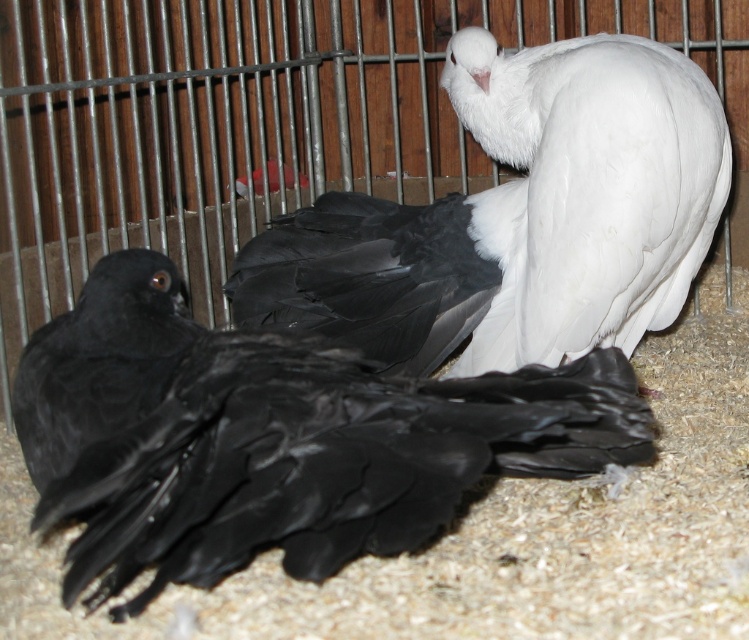
Based on the photo, you are a bird enthusiast observing the two pigeons in the cage. The black glossy feathers at center and the white feathered bird at upper right are both visible. Which of these two objects is positioned to the left of the other?

The black glossy feathers at center is positioned to the left of the white feathered bird at upper right according to the description.

From the picture: You are a bird keeper who needs to place a divider between the black glossy feathers at center and the white feathered bird at upper right to separate them. The divider you have is 16 inches long. Will it be sufficient to place between them?

The black glossy feathers at center and white feathered bird at upper right are 16.51 inches apart. Since the divider is only 16 inches long, it will not be sufficient to cover the entire distance between them.

You are a birdwatcher observing the pigeons in the cage. You notice the black glossy feathers at center and the white feathered bird at upper right. Which of these two has a greater height?

The white feathered bird at upper right is taller than the black glossy feathers at center.